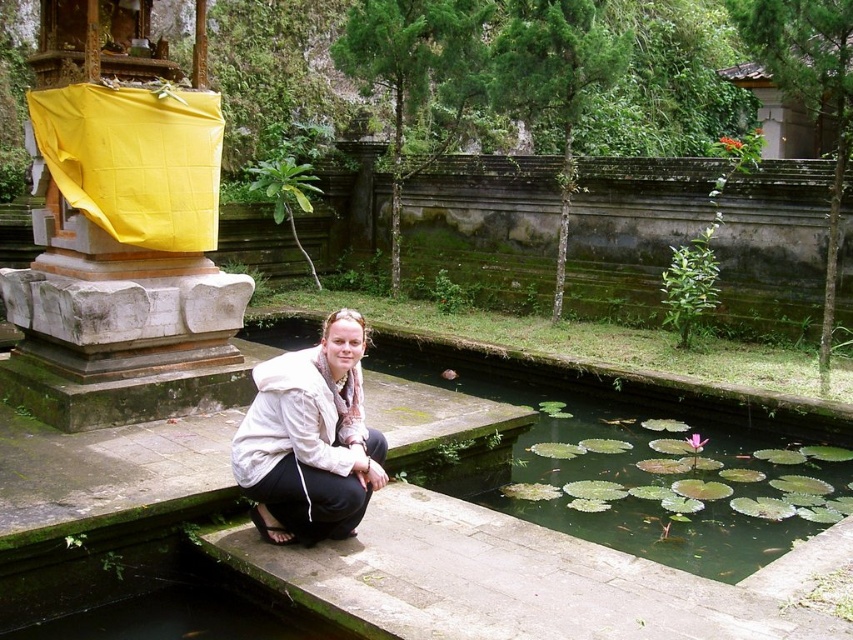
Looking at this image, how much distance is there between green lily pads at center and white fabric at center?

green lily pads at center is 8.44 meters from white fabric at center.

Does green lily pads at center lie in front of white fabric at center?

That is False.

Find the location of `green lily pads at center`. green lily pads at center is located at coordinates (643, 456).